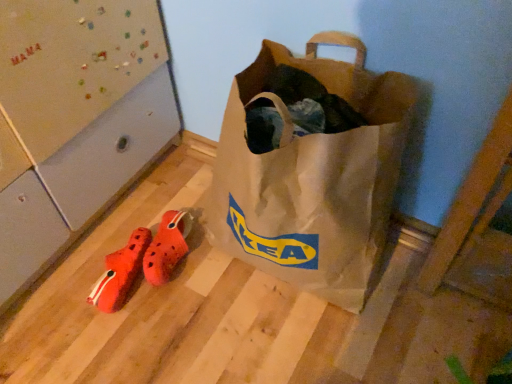
What are the coordinates of `vacant space in front of matte brown paper bag at center` in the screenshot? It's located at (303, 346).